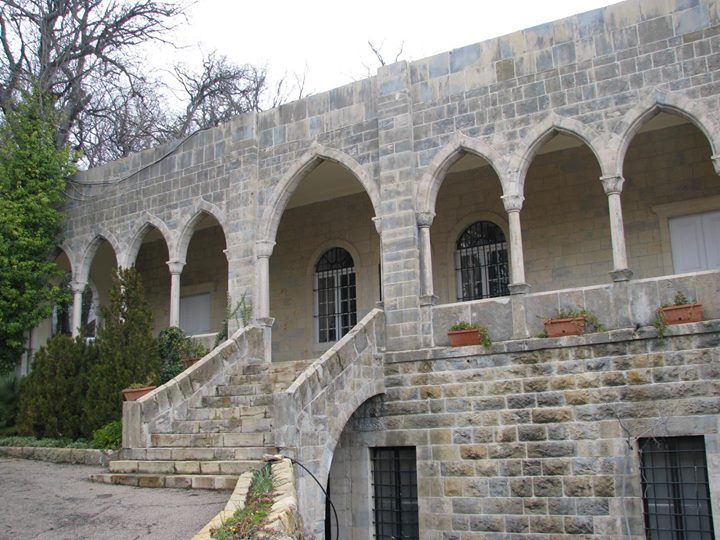
Identify the location of pillar. The width and height of the screenshot is (720, 540). (516, 244), (618, 240), (427, 247), (263, 284), (174, 287), (120, 295), (76, 307).